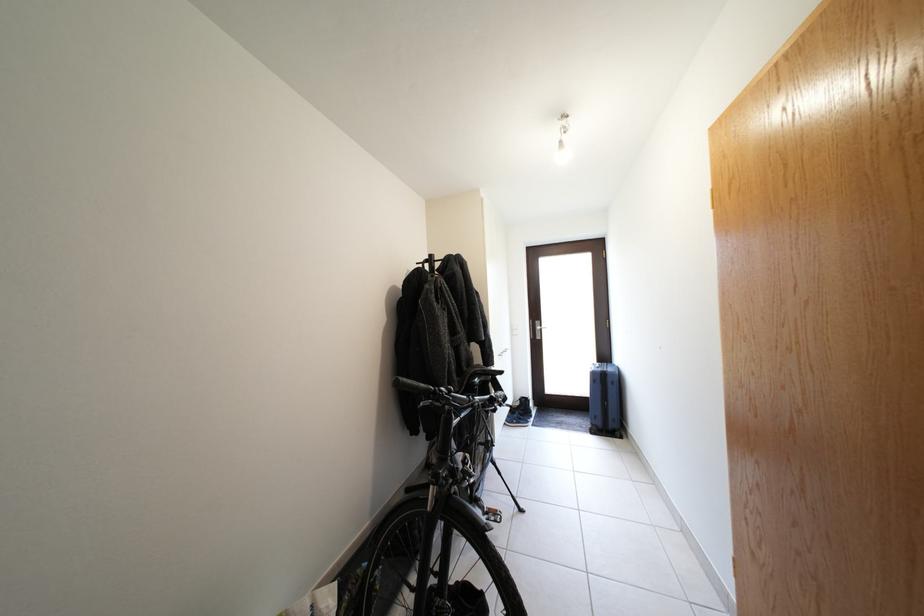
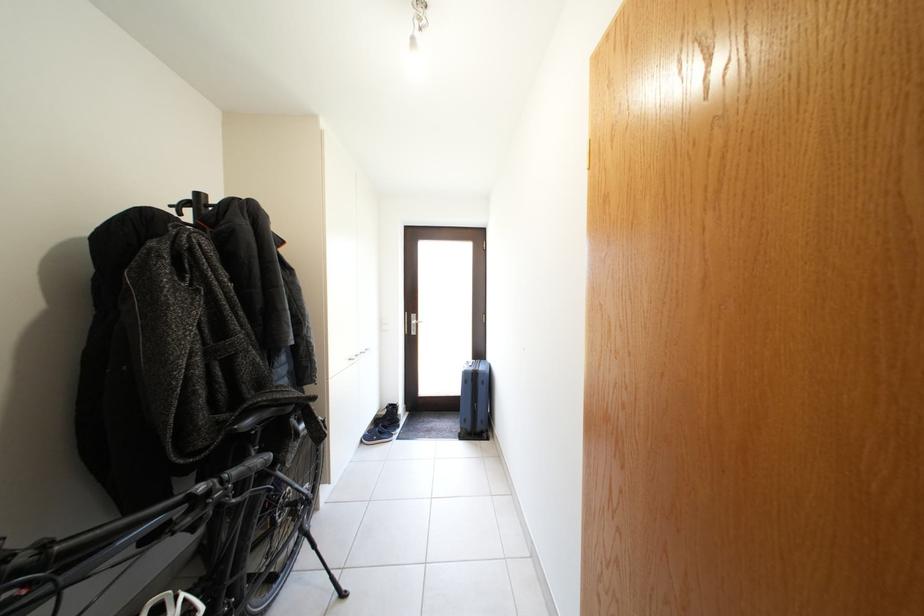
In the second image, find the point that corresponds to the point at 602,379 in the first image.

(473, 379)